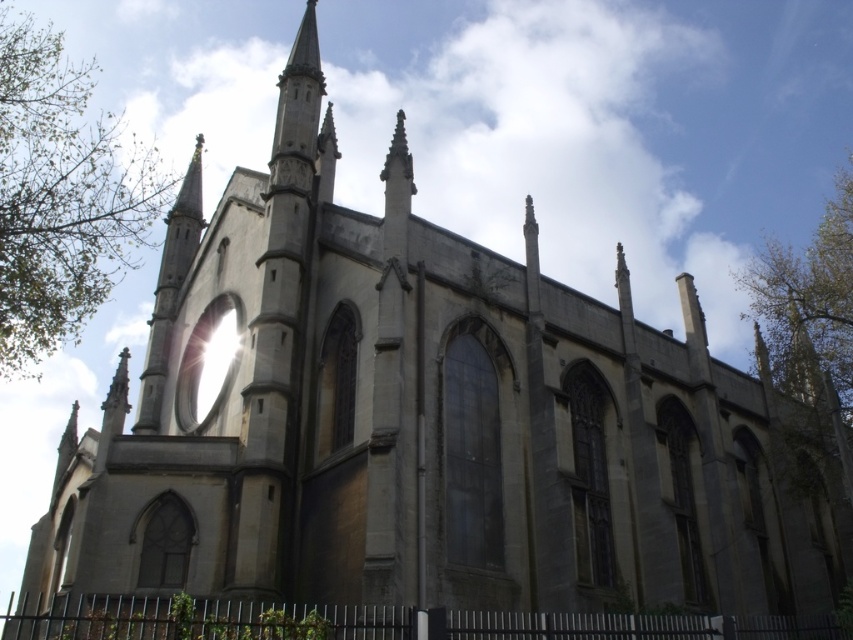
Question: Is green leafy tree at left smaller than green leafy tree at upper right?

Choices:
 (A) no
 (B) yes

Answer: (A)

Question: Does green leafy tree at left come in front of green leafy tree at upper right?

Choices:
 (A) no
 (B) yes

Answer: (B)

Question: Which point is closer to the camera?

Choices:
 (A) (131, 236)
 (B) (809, 268)

Answer: (B)

Question: Is green leafy tree at left to the right of green leafy tree at upper right from the viewer's perspective?

Choices:
 (A) yes
 (B) no

Answer: (B)

Question: Which point appears closest to the camera in this image?

Choices:
 (A) (42, 326)
 (B) (840, 305)

Answer: (A)